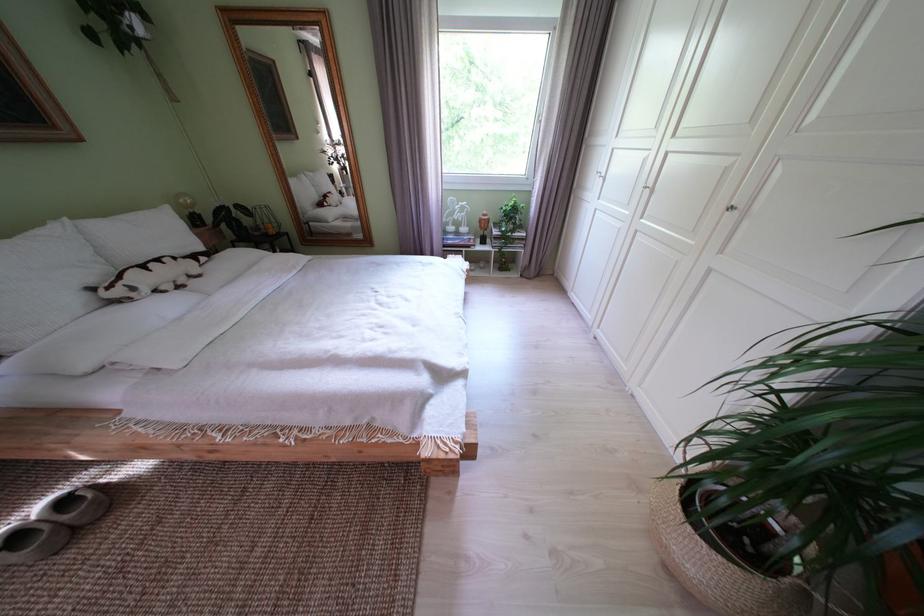
Which object does [189,209] point to?

It corresponds to the wireframe table lamp in the image.